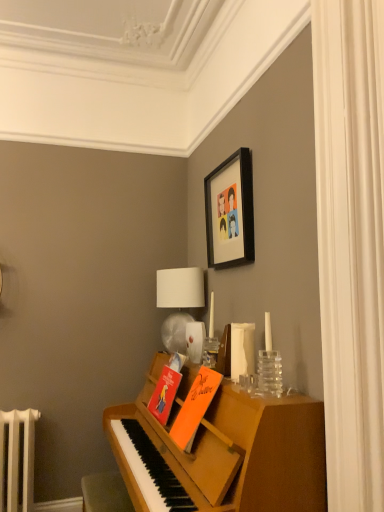
Question: Considering the relative sizes of white fabric lampshade at upper center and clear glass vase at right in the image provided, is white fabric lampshade at upper center thinner than clear glass vase at right?

Choices:
 (A) no
 (B) yes

Answer: (A)

Question: Is white fabric lampshade at upper center to the left of clear glass vase at right from the viewer's perspective?

Choices:
 (A) no
 (B) yes

Answer: (B)

Question: Can you confirm if white fabric lampshade at upper center is bigger than clear glass vase at right?

Choices:
 (A) yes
 (B) no

Answer: (A)

Question: Considering the relative sizes of white fabric lampshade at upper center and clear glass vase at right in the image provided, is white fabric lampshade at upper center wider than clear glass vase at right?

Choices:
 (A) no
 (B) yes

Answer: (B)

Question: Is white fabric lampshade at upper center closer to camera compared to clear glass vase at right?

Choices:
 (A) yes
 (B) no

Answer: (B)

Question: Looking at the image, does orange matte book at center, the 1th book from the front, seem bigger or smaller compared to white fabric curtain at right?

Choices:
 (A) small
 (B) big

Answer: (B)

Question: Would you say orange matte book at center, the 2th book when ordered from back to front, is to the left or to the right of white fabric curtain at right in the picture?

Choices:
 (A) right
 (B) left

Answer: (B)

Question: From a real-world perspective, is orange matte book at center, the 1th book from the front, above or below white fabric curtain at right?

Choices:
 (A) below
 (B) above

Answer: (A)

Question: From the image's perspective, relative to white fabric curtain at right, is orange matte book at center, the 1th book from the front, above or below?

Choices:
 (A) above
 (B) below

Answer: (B)

Question: From a real-world perspective, is white fabric lampshade at upper center positioned above or below matte orange book at center, which is the second book in front-to-back order?

Choices:
 (A) above
 (B) below

Answer: (A)

Question: Looking at the image, does white fabric lampshade at upper center seem bigger or smaller compared to matte orange book at center, acting as the first book starting from the back?

Choices:
 (A) small
 (B) big

Answer: (B)

Question: Is point (201, 274) closer or farther from the camera than point (167, 392)?

Choices:
 (A) farther
 (B) closer

Answer: (A)

Question: Is white fabric lampshade at upper center taller or shorter than matte orange book at center, acting as the first book starting from the back?

Choices:
 (A) tall
 (B) short

Answer: (A)

Question: Is point (157, 408) closer or farther from the camera than point (365, 390)?

Choices:
 (A) farther
 (B) closer

Answer: (A)

Question: Considering the positions of matte orange book at center, which is the second book in front-to-back order, and white fabric curtain at right in the image, is matte orange book at center, which is the second book in front-to-back order, taller or shorter than white fabric curtain at right?

Choices:
 (A) short
 (B) tall

Answer: (A)